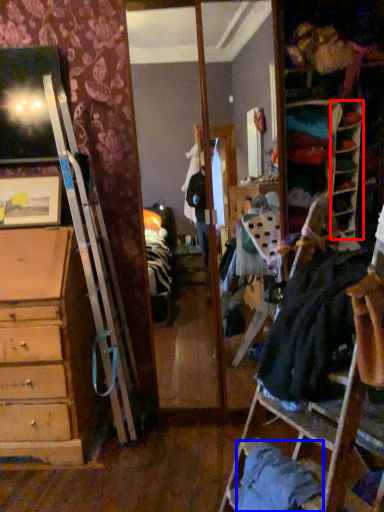
Question: Which of the following is the closest to the observer, shelf (highlighted by a red box) or clothing (highlighted by a blue box)?

Choices:
 (A) shelf
 (B) clothing

Answer: (B)